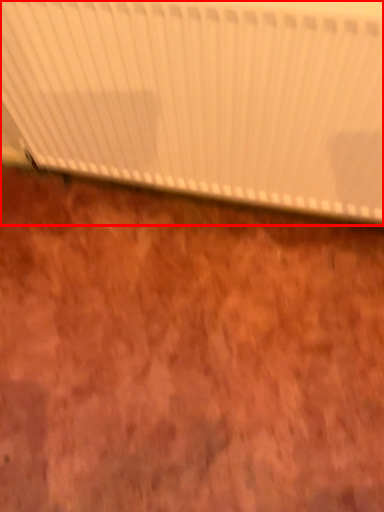
Question: Considering the relative positions of curtain (annotated by the red box) and plywood in the image provided, where is curtain (annotated by the red box) located with respect to the staircase?

Choices:
 (A) left
 (B) right

Answer: (B)